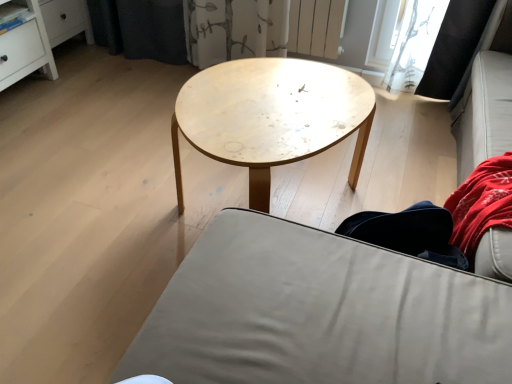
Measure the distance between matte gray fabric couch at center and camera.

The depth of matte gray fabric couch at center is 28.82 inches.

What are the coordinates of `natural wood coffee table at center` in the screenshot? It's located at (271, 117).

How much distance is there between matte gray fabric couch at center and denim pants at lower right?

matte gray fabric couch at center is 11.22 inches from denim pants at lower right.

Would you say matte gray fabric couch at center is a long distance from denim pants at lower right?

Actually, matte gray fabric couch at center and denim pants at lower right are a little close together.

Considering the relative sizes of matte gray fabric couch at center and denim pants at lower right in the image provided, is matte gray fabric couch at center smaller than denim pants at lower right?

Actually, matte gray fabric couch at center might be larger than denim pants at lower right.

Is matte gray fabric couch at center oriented away from denim pants at lower right?

No.

Which of these two, natural wood coffee table at center or denim pants at lower right, is thinner?

denim pants at lower right.

From a real-world perspective, does natural wood coffee table at center stand above denim pants at lower right?

No.

In the scene shown: Is natural wood coffee table at center next to denim pants at lower right and touching it?

No, natural wood coffee table at center is not next to denim pants at lower right.

Considering the relative sizes of natural wood coffee table at center and denim pants at lower right in the image provided, is natural wood coffee table at center shorter than denim pants at lower right?

In fact, natural wood coffee table at center may be taller than denim pants at lower right.

Is natural wood coffee table at center at the back of denim pants at lower right?

No, denim pants at lower right is not facing away from natural wood coffee table at center.

Between denim pants at lower right and natural wood coffee table at center, which one is positioned behind?

Positioned behind is natural wood coffee table at center.

In terms of height, does denim pants at lower right look taller or shorter compared to natural wood coffee table at center?

denim pants at lower right is shorter than natural wood coffee table at center.

Is point (493, 212) closer to viewer compared to point (304, 232)?

No, it is behind (304, 232).

Would you say matte gray fabric couch at center is part of denim pants at lower right's contents?

No, matte gray fabric couch at center is located outside of denim pants at lower right.

From the image's perspective, is denim pants at lower right located above or below matte gray fabric couch at center?

Based on their image positions, denim pants at lower right is located above matte gray fabric couch at center.

Is denim pants at lower right not near matte gray fabric couch at center?

No, denim pants at lower right is not far from matte gray fabric couch at center.

This screenshot has width=512, height=384. I want to click on studio couch above the natural wood coffee table at center (from a real-world perspective), so click(x=319, y=313).

What's the angular difference between natural wood coffee table at center and matte gray fabric couch at center's facing directions?

90.2 degrees.

From the image's perspective, between natural wood coffee table at center and matte gray fabric couch at center, which one is located above?

natural wood coffee table at center, from the image's perspective.

Can you confirm if natural wood coffee table at center is thinner than matte gray fabric couch at center?

No, natural wood coffee table at center is not thinner than matte gray fabric couch at center.

Which object is closer to the camera, matte gray fabric couch at center or natural wood coffee table at center?

matte gray fabric couch at center is in front.

Considering the sizes of objects matte gray fabric couch at center and natural wood coffee table at center in the image provided, who is wider, matte gray fabric couch at center or natural wood coffee table at center?

With larger width is natural wood coffee table at center.

Is point (279, 227) positioned before point (176, 119)?

Yes.

Where is `studio couch on the left side of denim pants at lower right`? This screenshot has height=384, width=512. studio couch on the left side of denim pants at lower right is located at coordinates (319, 313).

The image size is (512, 384). Identify the location of couple below the natural wood coffee table at center (from the image's perspective). (454, 214).

Estimate the real-world distances between objects in this image. Which object is closer to matte gray fabric couch at center, natural wood coffee table at center or denim pants at lower right?

Among the two, denim pants at lower right is located nearer to matte gray fabric couch at center.

Looking at the image, which one is located closer to denim pants at lower right, matte gray fabric couch at center or natural wood coffee table at center?

Based on the image, matte gray fabric couch at center appears to be nearer to denim pants at lower right.

Which object lies further to the anchor point denim pants at lower right, natural wood coffee table at center or matte gray fabric couch at center?

natural wood coffee table at center.

Considering their positions, is denim pants at lower right positioned further to natural wood coffee table at center than matte gray fabric couch at center?

The object further to natural wood coffee table at center is denim pants at lower right.

Based on their spatial positions, is matte gray fabric couch at center or denim pants at lower right further from natural wood coffee table at center?

denim pants at lower right is further to natural wood coffee table at center.

From the image, which object appears to be nearer to matte gray fabric couch at center, denim pants at lower right or natural wood coffee table at center?

denim pants at lower right is positioned closer to the anchor matte gray fabric couch at center.

Identify the location of couple located between matte gray fabric couch at center and natural wood coffee table at center in the depth direction. This screenshot has width=512, height=384. (454, 214).